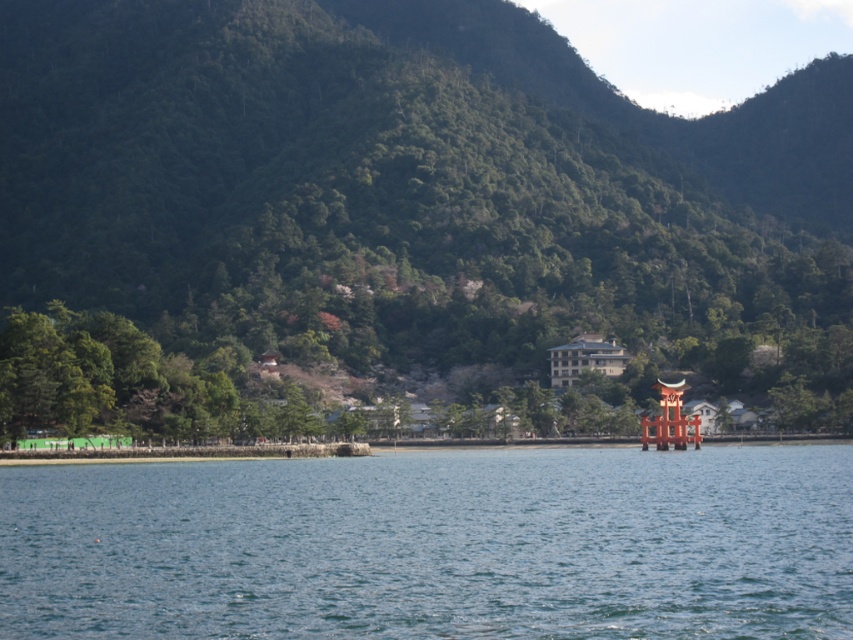
Question: Is green leafy mountain at upper center further to camera compared to clear blue water at center?

Choices:
 (A) yes
 (B) no

Answer: (A)

Question: Does green leafy mountain at upper center appear on the right side of clear blue water at center?

Choices:
 (A) yes
 (B) no

Answer: (B)

Question: Among these objects, which one is farthest from the camera?

Choices:
 (A) clear blue water at center
 (B) green leafy mountain at upper center

Answer: (B)

Question: Is green leafy mountain at upper center further to the viewer compared to clear blue water at center?

Choices:
 (A) yes
 (B) no

Answer: (A)

Question: Which point is farther to the camera?

Choices:
 (A) (202, 426)
 (B) (515, 472)

Answer: (A)